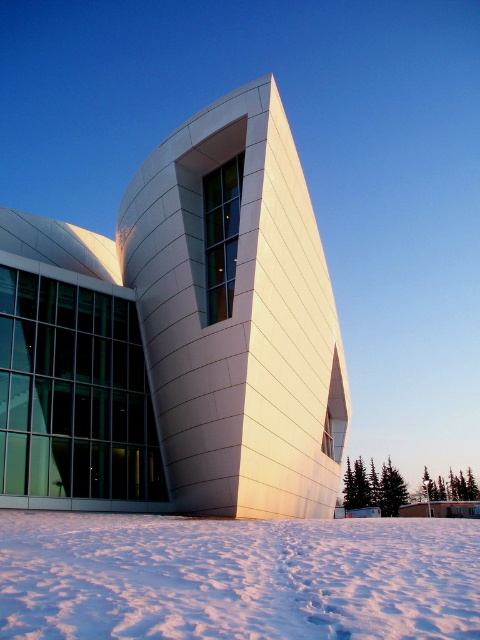
Question: Which point is closer to the camera taking this photo?

Choices:
 (A) (169, 182)
 (B) (129, 522)

Answer: (B)

Question: Can you confirm if white smooth building at center is smaller than white powdery snow at lower center?

Choices:
 (A) yes
 (B) no

Answer: (B)

Question: Which point is farther to the camera?

Choices:
 (A) 6,541
 (B) 67,230

Answer: (B)

Question: Does white smooth building at center appear over white powdery snow at lower center?

Choices:
 (A) yes
 (B) no

Answer: (A)

Question: Where is white smooth building at center located in relation to white powdery snow at lower center in the image?

Choices:
 (A) right
 (B) left

Answer: (A)